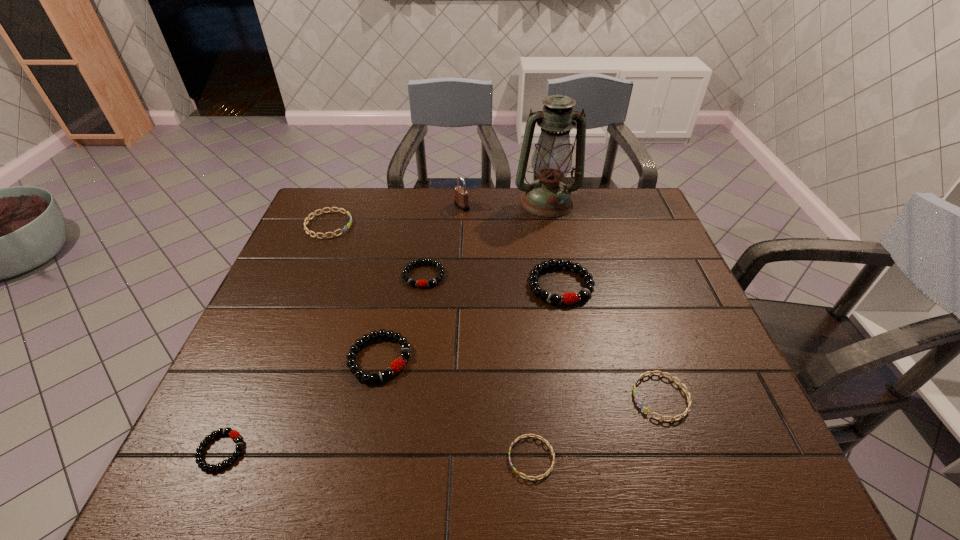
In the image, there is a desktop. Where is `vacant space at the near right corner`? vacant space at the near right corner is located at coordinates (777, 467).

You are a GUI agent. You are given a task and a screenshot of the screen. Output one action in this format:
    pyautogui.click(x=<x>, y=<y>)
    Task: Click on the vacant area that lies between the second smallest black bracelet and the leftmost black bracelet
    
    Given the screenshot: What is the action you would take?
    pyautogui.click(x=323, y=363)

I want to click on vacant space that's between the second smallest black bracelet and the second nearest black bracelet, so click(x=401, y=316).

The width and height of the screenshot is (960, 540). Find the location of `free space between the third farthest black bracelet and the farthest blue bracelet`. free space between the third farthest black bracelet and the farthest blue bracelet is located at coordinates (354, 292).

Find the location of `vacant area between the leftmost blue bracelet and the rightmost blue bracelet`. vacant area between the leftmost blue bracelet and the rightmost blue bracelet is located at coordinates (494, 311).

Identify the location of vacant area that lies between the leftmost black bracelet and the fifth object from right to left. (342, 328).

Image resolution: width=960 pixels, height=540 pixels. I want to click on vacant space that's between the third farthest black bracelet and the nearest black bracelet, so pos(300,404).

Identify the location of unoccupied position between the oil lamp and the rightmost bracelet. (604, 300).

This screenshot has height=540, width=960. I want to click on free space between the third biggest black bracelet and the smallest black bracelet, so click(x=323, y=363).

I want to click on free space between the third biggest black bracelet and the smallest black bracelet, so click(x=323, y=363).